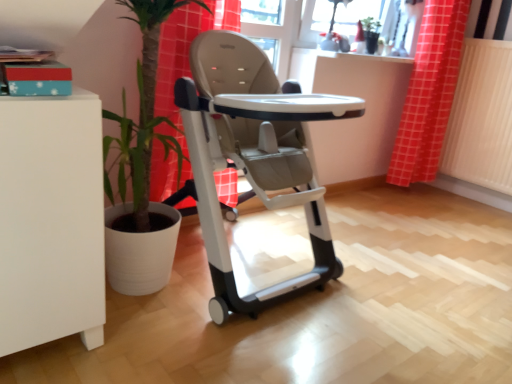
This screenshot has height=384, width=512. Identify the location of blank area beneath white textured radiator at right (from a real-world perspective). (472, 193).